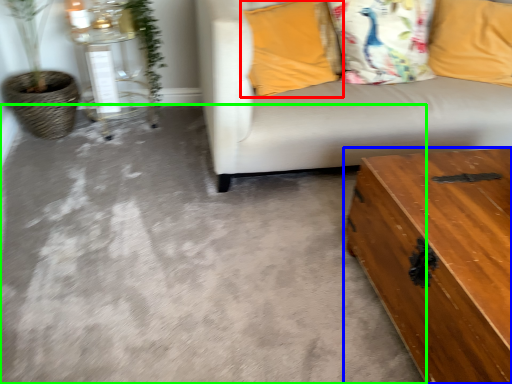
Question: Which object is the farthest from pillow (highlighted by a red box)? Choose among these: table (highlighted by a blue box) or concrete (highlighted by a green box).

Choices:
 (A) table
 (B) concrete

Answer: (A)